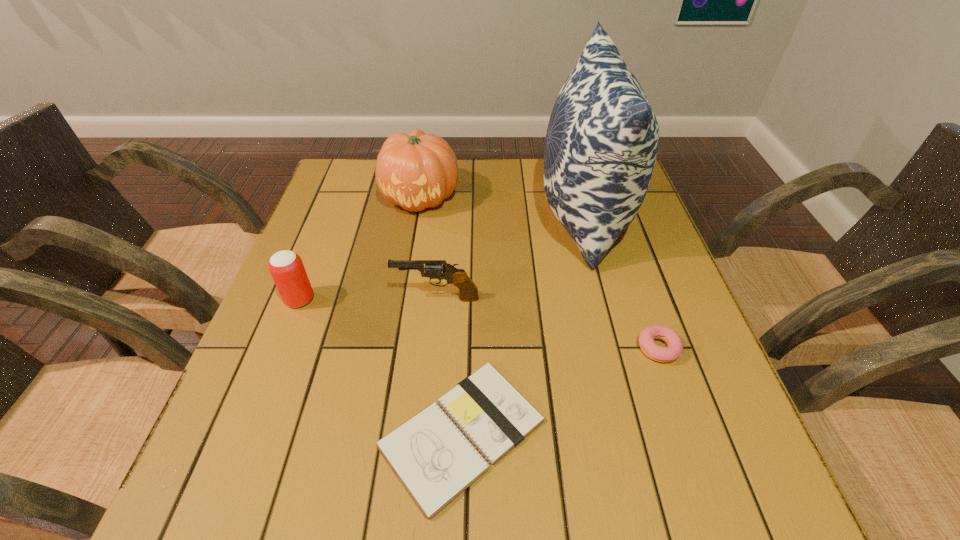
Locate an element on the screen. The height and width of the screenshot is (540, 960). unoccupied area between the pumpkin and the gun is located at coordinates (428, 248).

Locate an element on the screen. free space between the doughnut and the shortest object is located at coordinates (560, 390).

Where is `free area in between the beer can and the fifth tallest object`? Image resolution: width=960 pixels, height=540 pixels. free area in between the beer can and the fifth tallest object is located at coordinates (479, 324).

I want to click on blank region between the shortest object and the tallest object, so click(x=522, y=325).

This screenshot has width=960, height=540. What are the coordinates of `unoccupied position between the gun and the cushion` in the screenshot? It's located at (510, 257).

Where is `empty space that is in between the second tallest object and the notepad`? Image resolution: width=960 pixels, height=540 pixels. empty space that is in between the second tallest object and the notepad is located at coordinates (442, 315).

At what (x,y) coordinates should I click in order to perform the action: click on vacant area between the gun and the fifth tallest object. Please return your answer as a coordinate pair (x, y). Looking at the image, I should click on (547, 323).

I want to click on free area in between the leftmost object and the cushion, so click(442, 258).

Locate an element on the screen. The image size is (960, 540). free space that is in between the shortest object and the gun is located at coordinates click(449, 366).

Locate an element on the screen. free space that is in between the pumpkin and the leftmost object is located at coordinates pos(360,248).